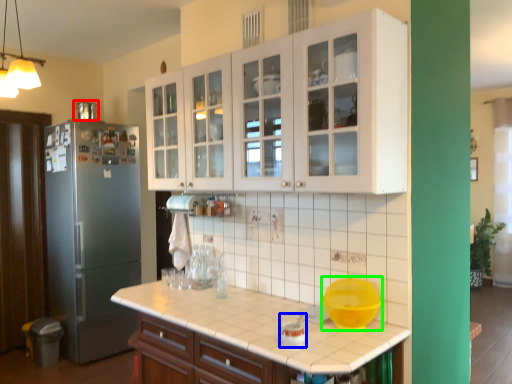
Question: Based on their relative distances, which object is nearer to appliance (highlighted by a red box)? Choose from appliance (highlighted by a blue box) and mixing bowl (highlighted by a green box).

Choices:
 (A) appliance
 (B) mixing bowl

Answer: (B)